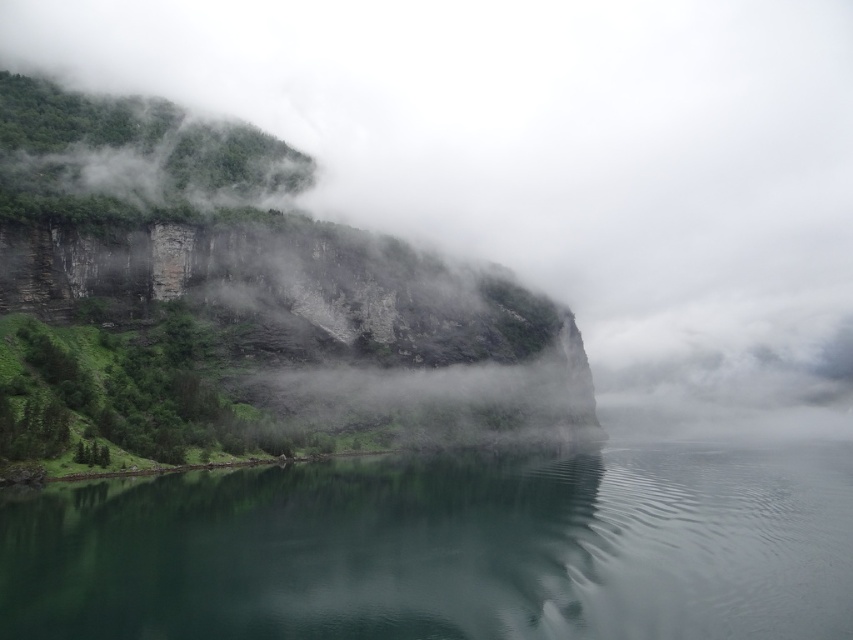
You are standing on a path near the green mossy rock at left and want to cross to the green reflective water at center. Based on the scene, which direction should you move to reach the water?

The green reflective water at center has a lesser height compared to the green mossy rock at left, so you should move downward towards the green reflective water at center to reach it.

You are a hiker who wants to cross from the green mossy rock at left to the green reflective water at center. Which object is closer to you as you start your journey?

The green mossy rock at left is closer to you as you start your journey because you are beginning near it, and the green reflective water at center is farther away.

You are standing on the edge of the cliff and want to locate the green reflective water at center. According to the coordinates provided, in which direction should you look relative to your position?

The green reflective water at center is located at coordinates point (x=445, y=550), so you should look downward and slightly to the right from your position on the cliff edge.